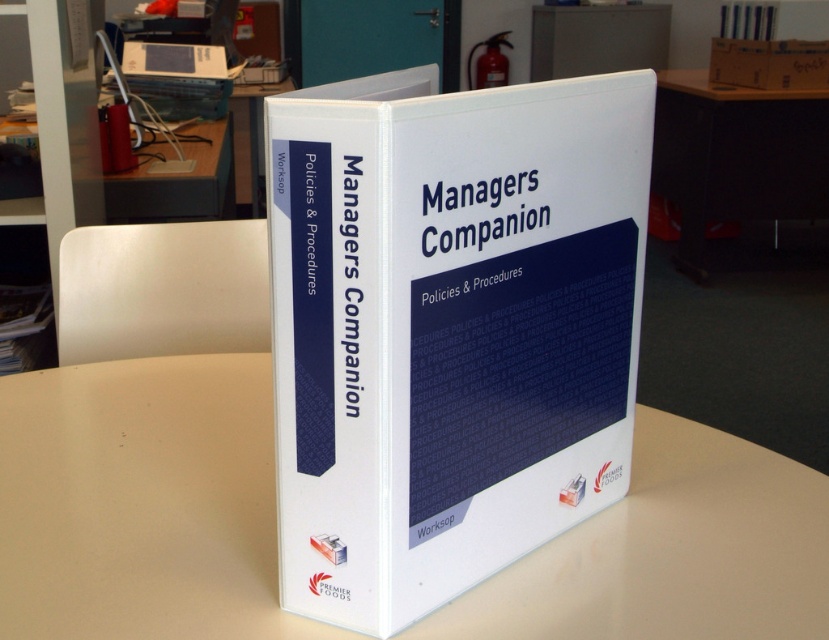
Question: Which object is closer to the camera taking this photo?

Choices:
 (A) white matte binder at center
 (B) white plastic bookshelf at lower left
 (C) white plastic round table at center
 (D) black plastic table at lower right

Answer: (A)

Question: Considering the real-world distances, which object is farthest from the white plastic bookshelf at lower left?

Choices:
 (A) brown cardboard box at upper right
 (B) black plastic table at lower right

Answer: (A)

Question: Which point is farther from the camera taking this photo?

Choices:
 (A) (769, 38)
 (B) (323, 467)

Answer: (A)

Question: Is black plastic table at lower right to the right of brown cardboard box at upper right from the viewer's perspective?

Choices:
 (A) no
 (B) yes

Answer: (A)

Question: In this image, where is white matte binder at center located relative to white plastic bookshelf at lower left?

Choices:
 (A) left
 (B) right

Answer: (B)

Question: Is white matte binder at center to the right of white plastic bookshelf at lower left from the viewer's perspective?

Choices:
 (A) no
 (B) yes

Answer: (B)